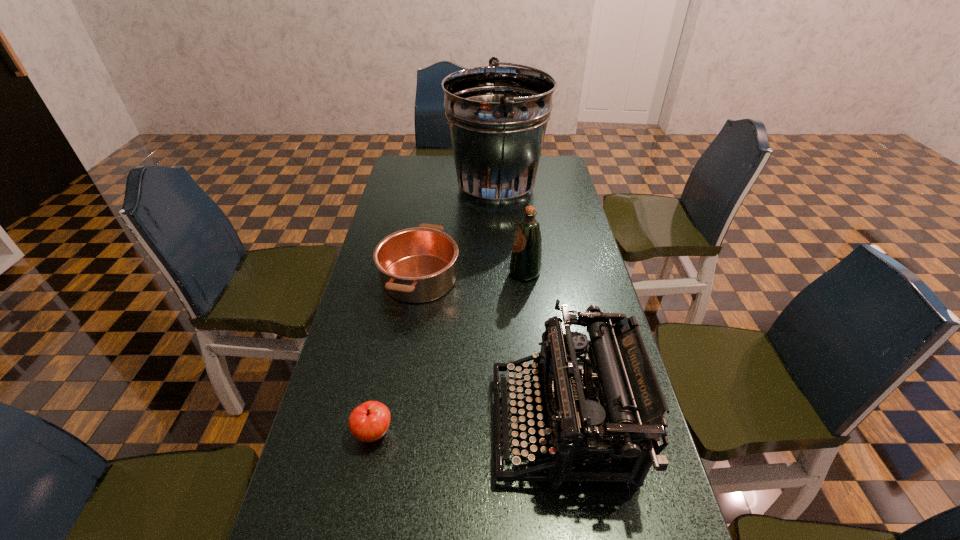
The image size is (960, 540). Identify the location of the farthest object. (497, 115).

What are the coordinates of `bucket` in the screenshot? It's located at (497, 115).

Find the location of a particular element. The height and width of the screenshot is (540, 960). olive oil is located at coordinates (526, 259).

Identify the location of typewriter. (608, 405).

Image resolution: width=960 pixels, height=540 pixels. Identify the location of saucepan. (416, 265).

You are a GUI agent. You are given a task and a screenshot of the screen. Output one action in this format:
    pyautogui.click(x=<x>, y=<y>)
    Task: Click on the apple
    
    Given the screenshot: What is the action you would take?
    pyautogui.click(x=368, y=422)

Where is `vacant space situated on the left of the tallest object`? This screenshot has width=960, height=540. vacant space situated on the left of the tallest object is located at coordinates click(401, 188).

Locate an element on the screen. This screenshot has height=540, width=960. blank area located on the front-facing side of the olive oil is located at coordinates (437, 273).

The height and width of the screenshot is (540, 960). I want to click on vacant space located 0.150m on the front-facing side of the olive oil, so click(x=462, y=273).

At what (x,y) coordinates should I click in order to perform the action: click on blank area located 0.050m on the front-facing side of the olive oil. Please return your answer as a coordinate pair (x, y). This screenshot has width=960, height=540. Looking at the image, I should click on (493, 273).